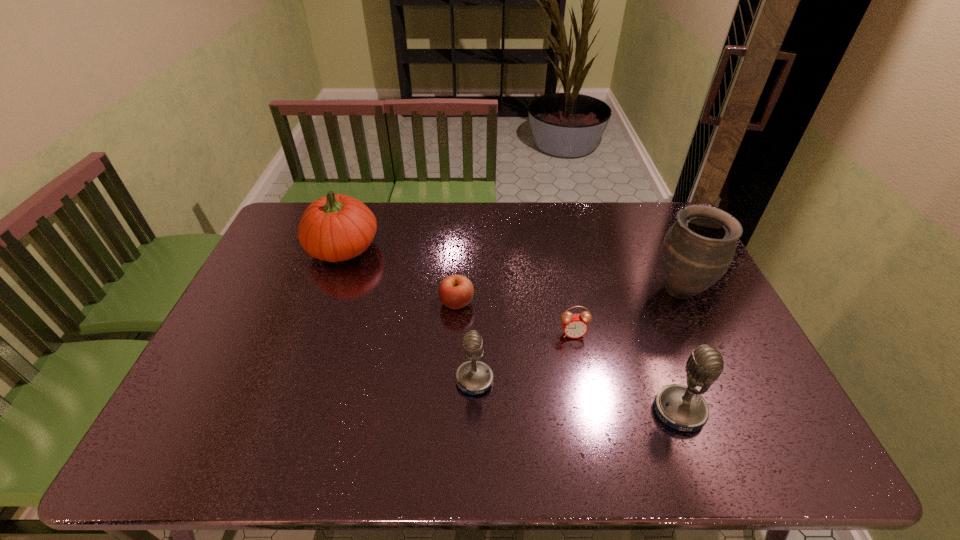
Please point a vacant point for placing a microphone on the left. Please provide its 2D coordinates. Your answer should be formatted as a tuple, i.e. [(x, y)], where the tuple contains the x and y coordinates of a point satisfying the conditions above.

[(292, 353)]